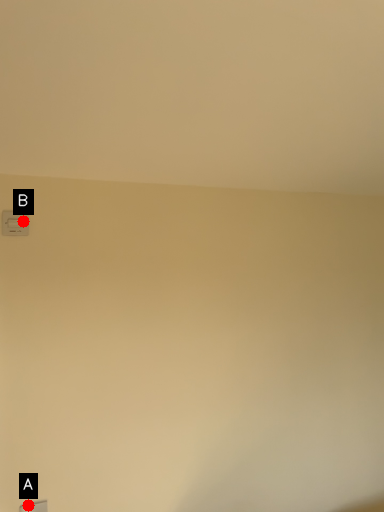
Question: Two points are circled on the image, labeled by A and B beside each circle. Among these points, which one is farthest from the camera?

Choices:
 (A) A is further
 (B) B is further

Answer: (B)